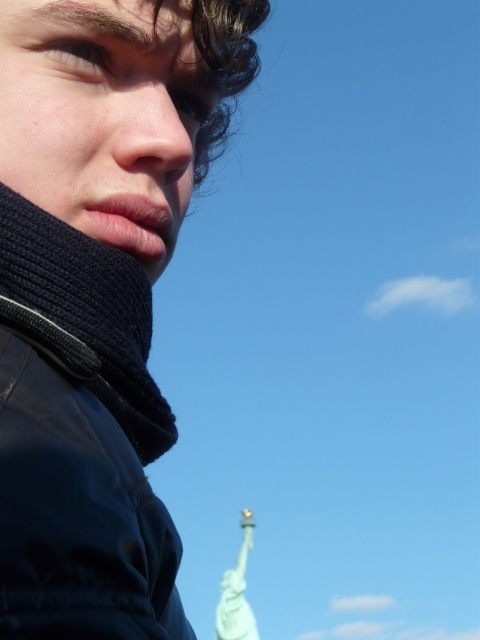
Question: Is matte black scarf at lower left positioned behind smooth skin nose at center?

Choices:
 (A) yes
 (B) no

Answer: (B)

Question: Is matte black scarf at lower left thinner than smooth skin nose at center?

Choices:
 (A) no
 (B) yes

Answer: (A)

Question: Which point is farther from the camera taking this photo?

Choices:
 (A) (189, 179)
 (B) (140, 305)

Answer: (A)

Question: Which of the following is the farthest from the observer?

Choices:
 (A) smooth skin nose at center
 (B) matte black scarf at lower left

Answer: (A)

Question: Is the position of matte black scarf at lower left less distant than that of smooth skin nose at center?

Choices:
 (A) yes
 (B) no

Answer: (A)

Question: Which point is farther to the camera?

Choices:
 (A) (132, 4)
 (B) (69, 442)

Answer: (A)